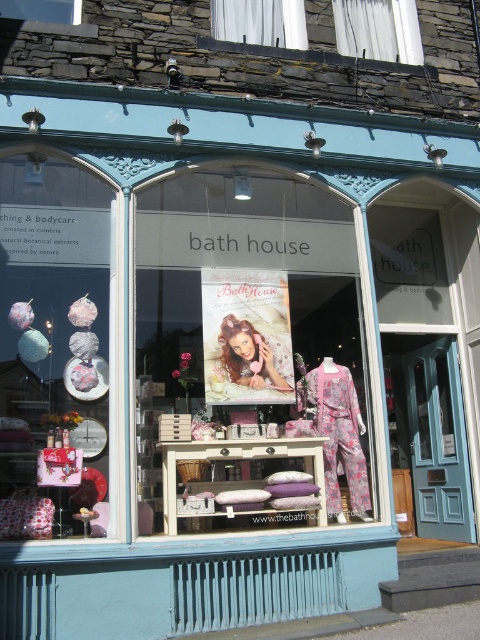
You are a customer looking at the shop window display. You see the floral fabric pajamas at center and the blonde hair at center. Which item is taller in the display?

The floral fabric pajamas at center is much taller than the blonde hair at center in the display.

Looking at this image, you are a customer browsing the shop window and notice the floral fabric dress at center and the matte fabric hats at left. Which item is taller when viewed from the outside?

The floral fabric dress at center is taller than the matte fabric hats at left.

You are standing in front of the Bath House shop and want to locate the floral fabric dress at center. According to the coordinates provided, where should you look relative to the shop window?

The floral fabric dress at center is located at coordinates point (247,355), which is near the center of the shop window.